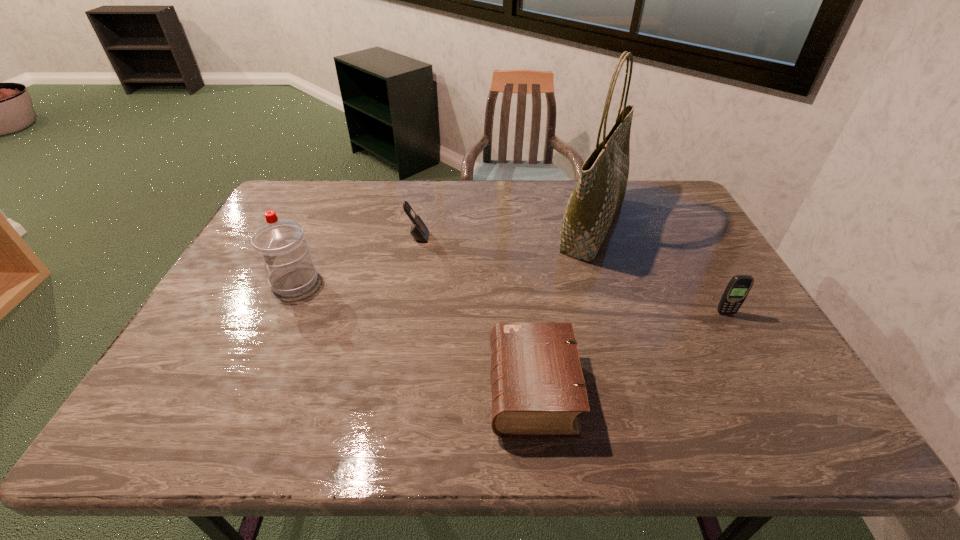
You are a GUI agent. You are given a task and a screenshot of the screen. Output one action in this format:
    pyautogui.click(x=<x>, y=<y>)
    Task: Click on the free region located on the left of the fourth object from left to right
    
    Given the screenshot: What is the action you would take?
    pyautogui.click(x=528, y=226)

At what (x,y) coordinates should I click in order to perform the action: click on free location located on the handle side of the leftmost object. Please return your answer as a coordinate pair (x, y). This screenshot has height=540, width=960. Looking at the image, I should click on (240, 281).

At what (x,y) coordinates should I click in order to perform the action: click on vacant space located on the front-facing side of the farther cellular telephone. Please return your answer as a coordinate pair (x, y). This screenshot has height=540, width=960. Looking at the image, I should click on (547, 237).

Find the location of `blank area located on the screen of the right cellular telephone`. blank area located on the screen of the right cellular telephone is located at coordinates (771, 393).

Locate an element on the screen. This screenshot has height=540, width=960. vacant space located 0.140m on the spine side of the shortest object is located at coordinates (427, 390).

The width and height of the screenshot is (960, 540). I want to click on blank area located 0.390m on the spine side of the shortest object, so click(x=316, y=390).

Locate an element on the screen. Image resolution: width=960 pixels, height=540 pixels. free location located on the spine side of the shortest object is located at coordinates (459, 390).

Where is `object that is at the far edge`? object that is at the far edge is located at coordinates (600, 191).

Locate an element on the screen. The width and height of the screenshot is (960, 540). object that is positioned at the near edge is located at coordinates (538, 390).

Identify the location of object located in the left edge section of the desktop. The height and width of the screenshot is (540, 960). (281, 243).